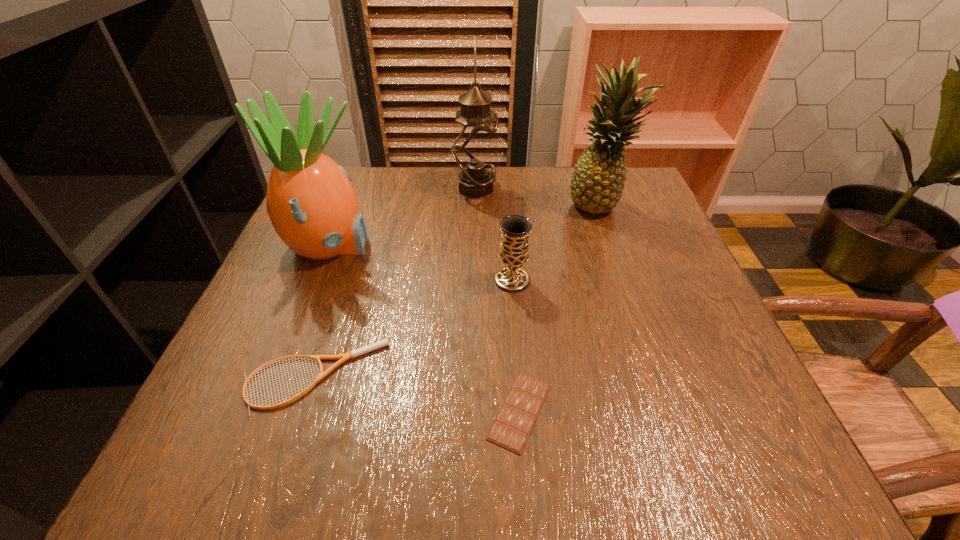
Identify the location of oil lamp. The height and width of the screenshot is (540, 960). (475, 132).

Identify the location of the right pineapple. This screenshot has height=540, width=960. (597, 182).

The width and height of the screenshot is (960, 540). I want to click on the left pineapple, so click(x=313, y=207).

Locate an element on the screen. Image resolution: width=960 pixels, height=540 pixels. the fourth tallest object is located at coordinates (515, 230).

Where is `the fifth tallest object`? The height and width of the screenshot is (540, 960). the fifth tallest object is located at coordinates (352, 354).

The width and height of the screenshot is (960, 540). I want to click on the shortest object, so click(514, 422).

Identify the location of vacant region located on the right of the oil lamp. The height and width of the screenshot is (540, 960). (613, 188).

Image resolution: width=960 pixels, height=540 pixels. I want to click on blank area located on the back of the right pineapple, so click(x=587, y=170).

This screenshot has height=540, width=960. Identify the location of free space located at the entrance of the left pineapple. (488, 247).

Locate an element on the screen. The width and height of the screenshot is (960, 540). vacant area located 0.150m on the front of the chalice is located at coordinates (518, 354).